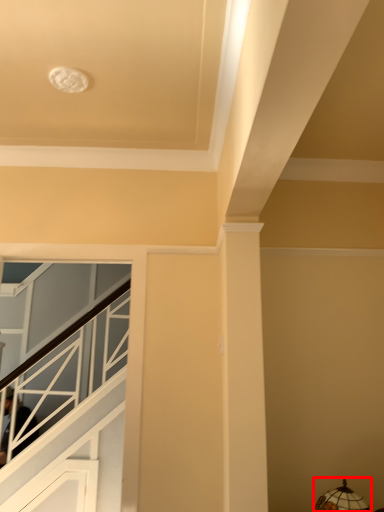
Question: From the image's perspective, what is the correct spatial positioning of lamp (annotated by the red box) in reference to stairwell?

Choices:
 (A) above
 (B) below

Answer: (A)